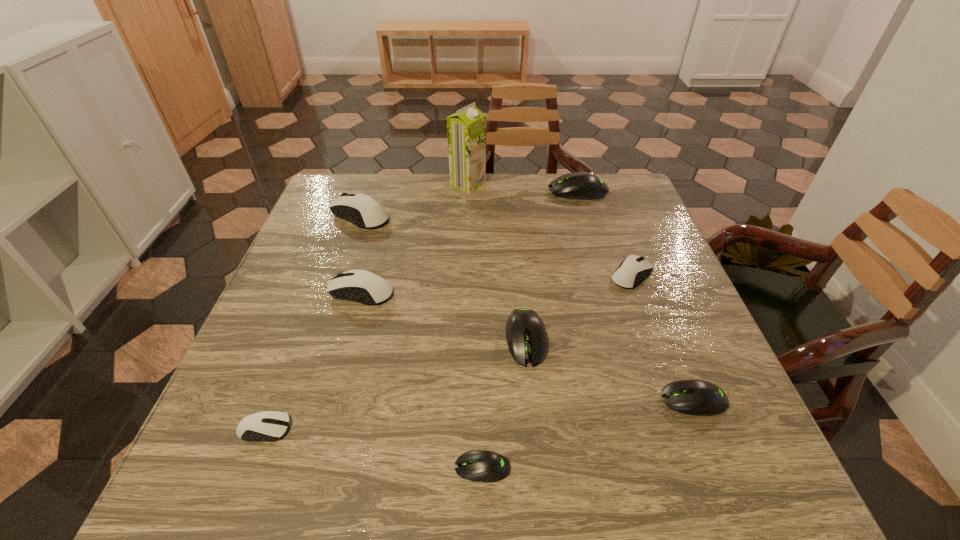
Image resolution: width=960 pixels, height=540 pixels. I want to click on free space located 0.350m on the wheel side of the farthest computer mouse, so click(x=432, y=191).

This screenshot has height=540, width=960. What are the coordinates of `vacant space located 0.260m on the right of the second biggest white mouse` in the screenshot? It's located at (506, 291).

This screenshot has height=540, width=960. What are the coordinates of `vacant space located on the wheel side of the sixth object from left to right` in the screenshot? It's located at (540, 490).

Where is `free space located on the back of the second smallest white mouse`? The height and width of the screenshot is (540, 960). free space located on the back of the second smallest white mouse is located at coordinates (616, 233).

Where is `vacant space located 0.300m on the wheel side of the second smallest gray computer mouse`? vacant space located 0.300m on the wheel side of the second smallest gray computer mouse is located at coordinates (497, 400).

The width and height of the screenshot is (960, 540). In order to click on vacant space located on the wheel side of the second smallest gray computer mouse in this screenshot , I will do click(508, 400).

This screenshot has height=540, width=960. Identify the location of vacant space located 0.110m on the wheel side of the second smallest gray computer mouse. tap(600, 400).

Where is `vacant space located 0.100m on the right of the nearest white mouse`? The image size is (960, 540). vacant space located 0.100m on the right of the nearest white mouse is located at coordinates (348, 429).

Locate an element on the screen. Image resolution: width=960 pixels, height=540 pixels. vacant point located 0.170m on the wheel side of the fifth computer mouse from right to left is located at coordinates (350, 468).

You are a GUI agent. You are given a task and a screenshot of the screen. Output one action in this format:
    pyautogui.click(x=<x>, y=<y>)
    Task: Click on the vacant region located on the wheel side of the fifth computer mouse from right to left
    The height and width of the screenshot is (540, 960).
    Given the screenshot: What is the action you would take?
    pyautogui.click(x=394, y=468)